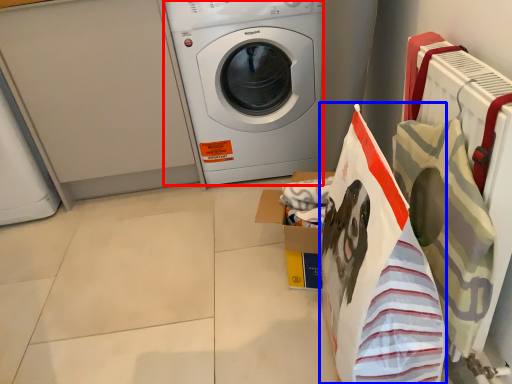
Question: Which of the following is the closest to the observer, washing machine (highlighted by a red box) or shopping bag (highlighted by a blue box)?

Choices:
 (A) washing machine
 (B) shopping bag

Answer: (B)